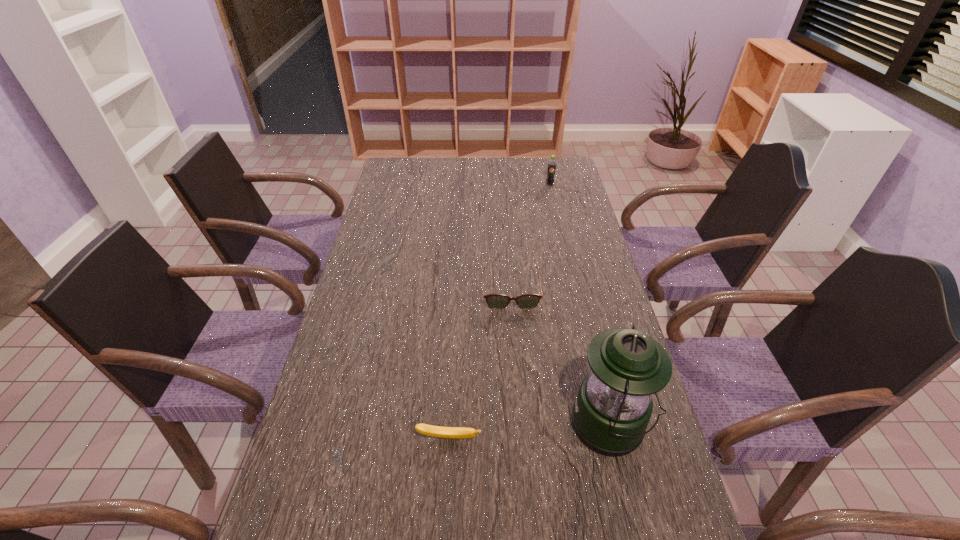
Where is `free space between the farthest object and the third object from right to left`? free space between the farthest object and the third object from right to left is located at coordinates (530, 238).

The height and width of the screenshot is (540, 960). I want to click on vacant point located between the lantern and the spectacles, so click(x=561, y=359).

This screenshot has height=540, width=960. I want to click on vacant area that lies between the leftmost object and the tallest object, so click(530, 431).

The image size is (960, 540). What are the coordinates of `free space that is in between the tallest object and the soda` in the screenshot? It's located at (580, 305).

I want to click on vacant space that's between the lantern and the banana, so click(x=530, y=431).

I want to click on vacant area between the leftmost object and the second farthest object, so click(480, 365).

Locate an element on the screen. This screenshot has height=540, width=960. free space between the second object from left to right and the soda is located at coordinates [x=530, y=238].

Find the location of a particular element. Image resolution: width=960 pixels, height=540 pixels. free space that is in between the second tallest object and the third nearest object is located at coordinates click(x=530, y=238).

Where is `object that stands as the second closest to the third shortest object`? The height and width of the screenshot is (540, 960). object that stands as the second closest to the third shortest object is located at coordinates (613, 407).

Select which object is the third closest to the spectacles. Please provide its 2D coordinates. Your answer should be formatted as a tuple, i.e. [(x, y)], where the tuple contains the x and y coordinates of a point satisfying the conditions above.

[(551, 169)]